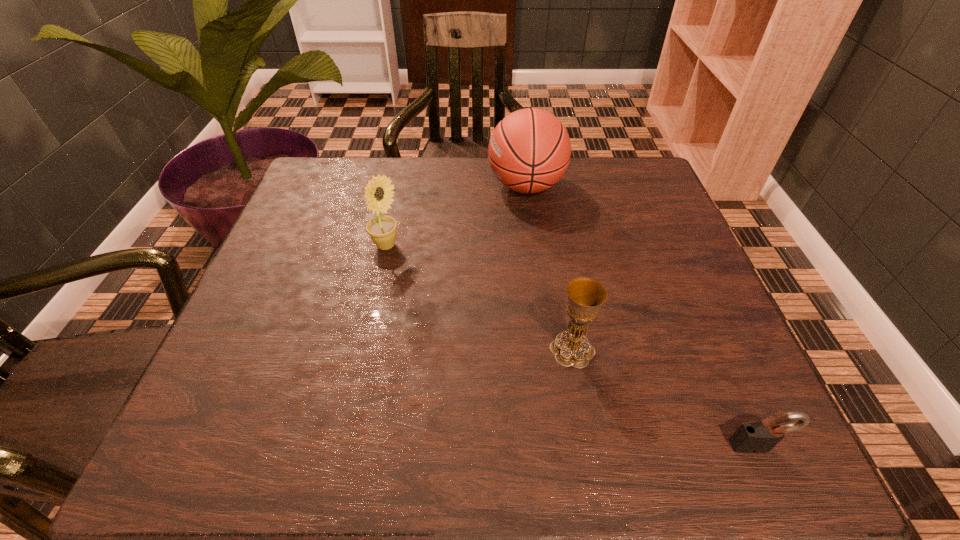
Locate which object ranks second in proximity to the second nearest object. Please provide its 2D coordinates. Your answer should be formatted as a tuple, i.e. [(x, y)], where the tuple contains the x and y coordinates of a point satisfying the conditions above.

[(382, 229)]

Choose which object is the nearest neighbor to the third tallest object. Please provide its 2D coordinates. Your answer should be formatted as a tuple, i.e. [(x, y)], where the tuple contains the x and y coordinates of a point satisfying the conditions above.

[(756, 437)]

The image size is (960, 540). I want to click on vacant area in the image that satisfies the following two spatial constraints: 1. on the face of the second nearest object; 2. on the right side of the second farthest object, so click(x=363, y=349).

At what (x,y) coordinates should I click in order to perform the action: click on free space that satisfies the following two spatial constraints: 1. on the logo side of the second shortest object; 2. on the right side of the basketball. Please return your answer as a coordinate pair (x, y). This screenshot has width=960, height=540. Looking at the image, I should click on (547, 349).

At what (x,y) coordinates should I click in order to perform the action: click on free point that satisfies the following two spatial constraints: 1. on the face of the chalice; 2. on the left side of the third nearest object. Please return your answer as a coordinate pair (x, y). Looking at the image, I should click on (363, 349).

Find the location of a particular element. blank area in the image that satisfies the following two spatial constraints: 1. on the logo side of the second shortest object; 2. on the right side of the farthest object is located at coordinates (547, 349).

Where is `free space that satisfies the following two spatial constraints: 1. on the face of the chalice; 2. on the right side of the sunflower`? free space that satisfies the following two spatial constraints: 1. on the face of the chalice; 2. on the right side of the sunflower is located at coordinates (363, 349).

The width and height of the screenshot is (960, 540). What are the coordinates of `free spot that satisfies the following two spatial constraints: 1. on the logo side of the second shortest object; 2. on the left side of the farthest object` in the screenshot? It's located at (547, 349).